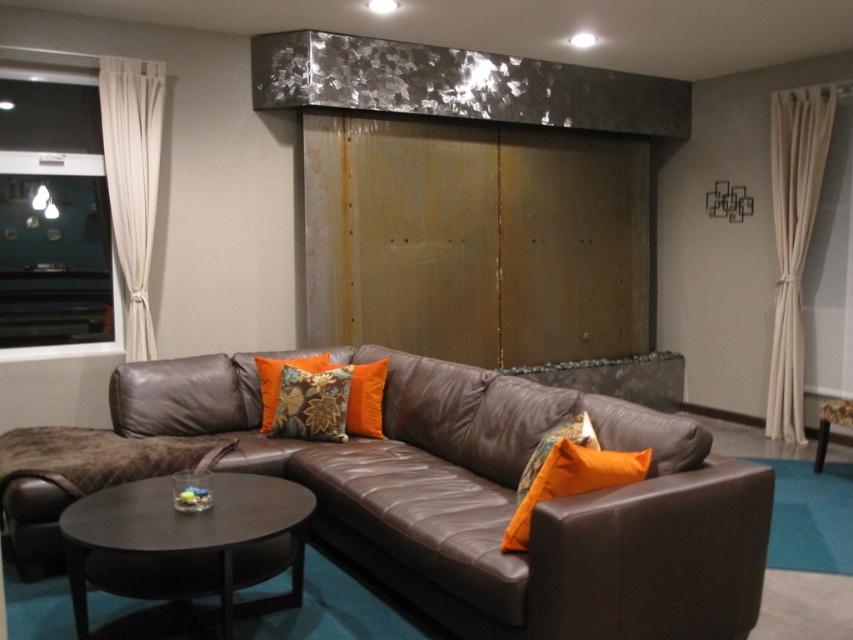
From the picture: Does white fabric curtain at left appear under orange fabric pillow at lower right?

Actually, white fabric curtain at left is above orange fabric pillow at lower right.

Which is below, white fabric curtain at left or orange fabric pillow at lower right?

orange fabric pillow at lower right is below.

Is point (146, 278) behind point (637, 458)?

Yes, it is behind point (637, 458).

Locate an element on the screen. white fabric curtain at left is located at coordinates (132, 180).

This screenshot has height=640, width=853. What do you see at coordinates (793, 241) in the screenshot? I see `beige fabric curtain at right` at bounding box center [793, 241].

Can you confirm if beige fabric curtain at right is shorter than orange fabric pillow at center?

In fact, beige fabric curtain at right may be taller than orange fabric pillow at center.

What do you see at coordinates (793, 241) in the screenshot?
I see `beige fabric curtain at right` at bounding box center [793, 241].

At what (x,y) coordinates should I click in order to perform the action: click on beige fabric curtain at right. Please return your answer as a coordinate pair (x, y). The height and width of the screenshot is (640, 853). Looking at the image, I should click on (793, 241).

From the picture: Does beige fabric curtain at right appear under floral-patterned fabric pillow at center?

Actually, beige fabric curtain at right is above floral-patterned fabric pillow at center.

The width and height of the screenshot is (853, 640). What are the coordinates of `beige fabric curtain at right` in the screenshot? It's located at point(793,241).